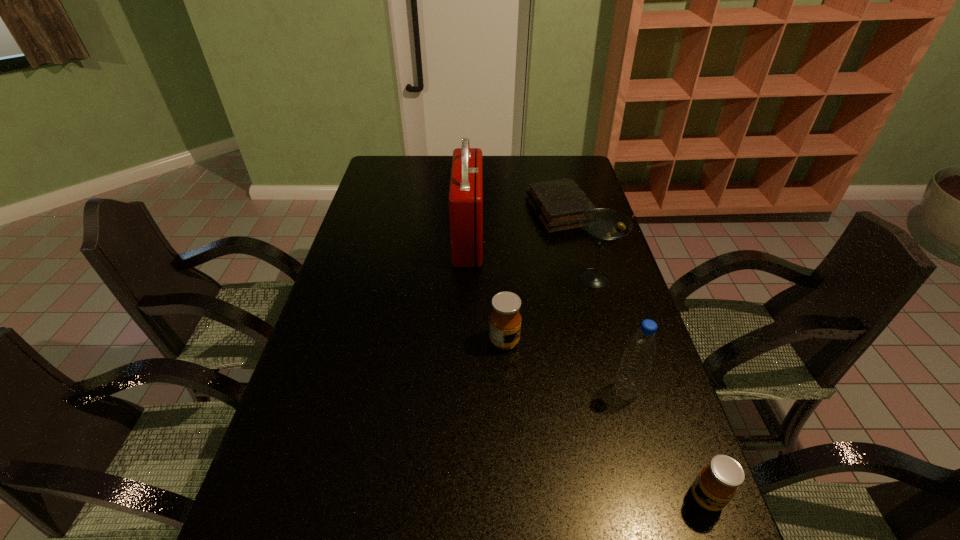
Where is `the third nearest object`? This screenshot has width=960, height=540. the third nearest object is located at coordinates (505, 319).

In order to click on the second object from left to right in this screenshot , I will do (505, 319).

You are a GUI agent. You are given a task and a screenshot of the screen. Output one action in this format:
    pyautogui.click(x=<x>, y=<y>)
    Task: Click on the nearer honey
    This screenshot has height=540, width=960.
    Given the screenshot: What is the action you would take?
    pyautogui.click(x=716, y=484)

Locate an element on the screen. the second shortest object is located at coordinates (716, 484).

Where is `book`? The width and height of the screenshot is (960, 540). book is located at coordinates (558, 204).

Where is `the first-aid kit`? The width and height of the screenshot is (960, 540). the first-aid kit is located at coordinates (465, 200).

Locate an element on the screen. The width and height of the screenshot is (960, 540). the tallest object is located at coordinates (465, 200).

The height and width of the screenshot is (540, 960). I want to click on the second nearest object, so click(641, 347).

Identify the location of martini. The image size is (960, 540). (604, 226).

Locate an element on the screen. vacant space situated 0.330m on the front-facing side of the taller honey is located at coordinates (643, 341).